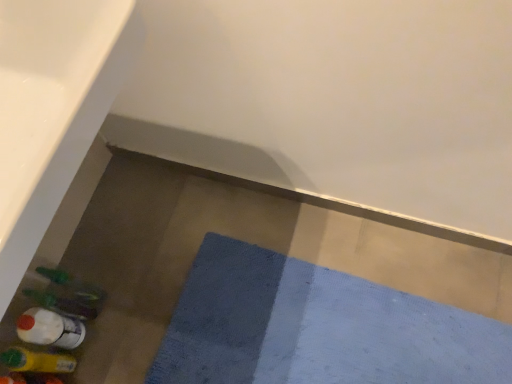
This screenshot has width=512, height=384. In order to click on vacant area that lies to the right of translucent plastic bottle at lower left, which ranks as the 3th bottle in top-to-bottom order in this screenshot , I will do `click(116, 341)`.